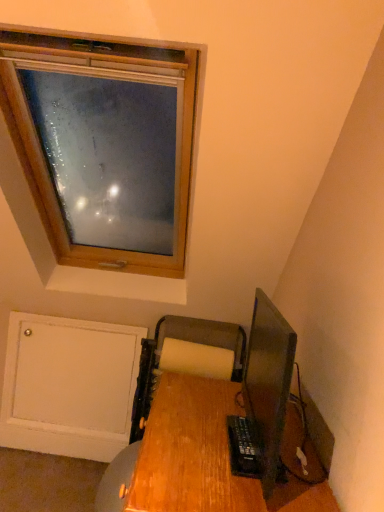
Question: Is wooden printer at lower center taller than wooden desk at lower right?

Choices:
 (A) yes
 (B) no

Answer: (A)

Question: Could you tell me if wooden printer at lower center is turned towards wooden desk at lower right?

Choices:
 (A) no
 (B) yes

Answer: (B)

Question: From a real-world perspective, is wooden printer at lower center positioned over wooden desk at lower right based on gravity?

Choices:
 (A) yes
 (B) no

Answer: (B)

Question: Could wooden desk at lower right be considered to be inside wooden printer at lower center?

Choices:
 (A) no
 (B) yes

Answer: (A)

Question: Considering the relative sizes of wooden printer at lower center and wooden desk at lower right in the image provided, is wooden printer at lower center thinner than wooden desk at lower right?

Choices:
 (A) no
 (B) yes

Answer: (B)

Question: Can you confirm if wooden printer at lower center is smaller than wooden desk at lower right?

Choices:
 (A) no
 (B) yes

Answer: (B)

Question: Does matte black monitor at lower right appear on the right side of wooden printer at lower center?

Choices:
 (A) yes
 (B) no

Answer: (A)

Question: From a real-world perspective, is matte black monitor at lower right over wooden printer at lower center?

Choices:
 (A) yes
 (B) no

Answer: (A)

Question: Is matte black monitor at lower right wider than wooden printer at lower center?

Choices:
 (A) no
 (B) yes

Answer: (A)

Question: Can you confirm if matte black monitor at lower right is positioned to the left of wooden printer at lower center?

Choices:
 (A) yes
 (B) no

Answer: (B)

Question: From the image's perspective, is matte black monitor at lower right located above wooden printer at lower center?

Choices:
 (A) no
 (B) yes

Answer: (B)

Question: Can you confirm if matte black monitor at lower right is shorter than wooden printer at lower center?

Choices:
 (A) no
 (B) yes

Answer: (B)

Question: From the image's perspective, is wooden desk at lower right under wooden printer at lower center?

Choices:
 (A) no
 (B) yes

Answer: (A)